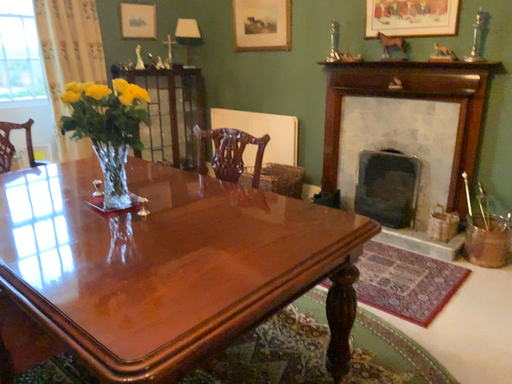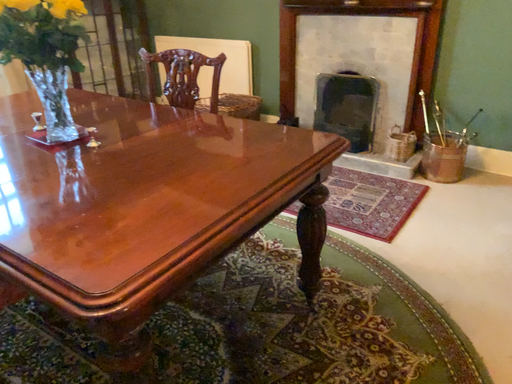
Question: How did the camera likely rotate when shooting the video?

Choices:
 (A) rotated downward
 (B) rotated upward

Answer: (A)